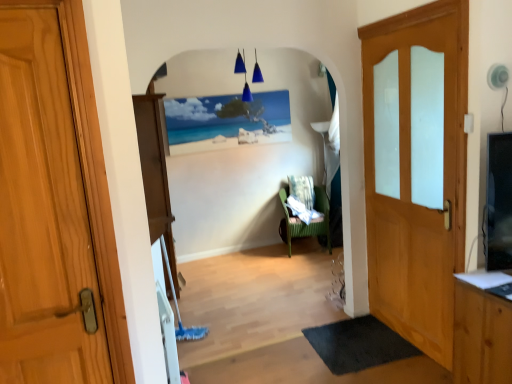
Find the location of a particular element. Image resolution: width=512 pixels, height=384 pixels. vacant area situated to the left side of green wicker chair at center is located at coordinates (266, 254).